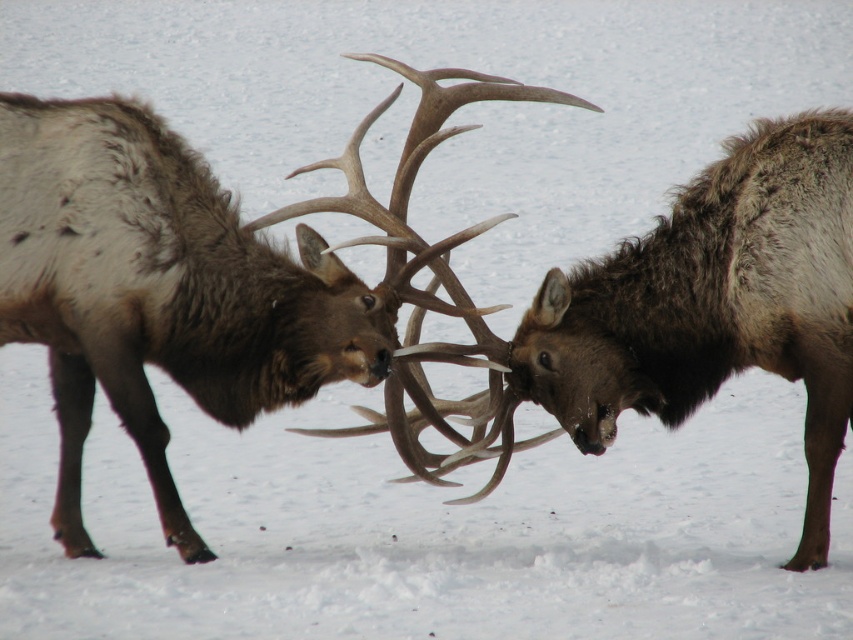
In the scene shown: You are a wildlife photographer trying to capture a closeup of the antlers of two elk in the snow. You have a camera with a 50mm lens. Knowing that the brown velvet antlers at center are larger than the brown fuzzy antlers at center, which antlers should you focus on to ensure the subject fills the frame without cropping?

The brown velvet antlers at center are larger in size than the brown fuzzy antlers at center, so focusing on the brown velvet antlers at center will ensure the subject fills the frame without cropping.

From the picture: You are an animal behavior researcher observing the two elk in the snowy landscape. You notice a specific point marked at coordinates point (x=202, y=276). Which object in the scene is located at this point?

The brown velvet antlers at center is located at point (x=202, y=276).